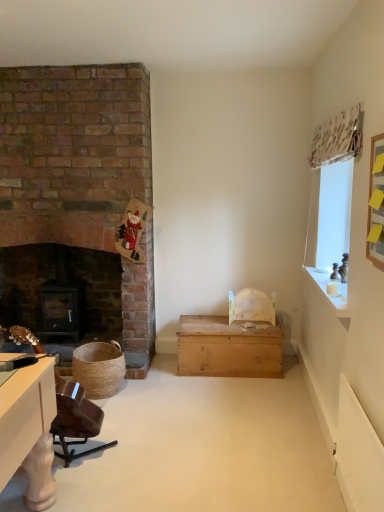
Question: Considering the relative sizes of white wood candle at upper right and wooden chest at center in the image provided, is white wood candle at upper right wider than wooden chest at center?

Choices:
 (A) yes
 (B) no

Answer: (B)

Question: From a real-world perspective, is white wood candle at upper right physically below wooden chest at center?

Choices:
 (A) yes
 (B) no

Answer: (B)

Question: Is white wood candle at upper right aimed at wooden chest at center?

Choices:
 (A) yes
 (B) no

Answer: (B)

Question: Considering the relative sizes of white wood candle at upper right and wooden chest at center in the image provided, is white wood candle at upper right taller than wooden chest at center?

Choices:
 (A) yes
 (B) no

Answer: (B)

Question: Considering the relative positions of white wood candle at upper right and wooden chest at center in the image provided, is white wood candle at upper right to the left of wooden chest at center from the viewer's perspective?

Choices:
 (A) yes
 (B) no

Answer: (B)

Question: From the image's perspective, is white wood candle at upper right beneath wooden chest at center?

Choices:
 (A) no
 (B) yes

Answer: (A)

Question: Is wooden chest at center taller than brown wood swivel chair at lower left?

Choices:
 (A) no
 (B) yes

Answer: (A)

Question: Does wooden chest at center have a larger size compared to brown wood swivel chair at lower left?

Choices:
 (A) yes
 (B) no

Answer: (A)

Question: Could you tell me if wooden chest at center is turned towards brown wood swivel chair at lower left?

Choices:
 (A) yes
 (B) no

Answer: (A)

Question: Is wooden chest at center to the right of brown wood swivel chair at lower left from the viewer's perspective?

Choices:
 (A) yes
 (B) no

Answer: (A)

Question: Can you confirm if wooden chest at center is shorter than brown wood swivel chair at lower left?

Choices:
 (A) no
 (B) yes

Answer: (B)

Question: From the image's perspective, does wooden chest at center appear lower than brown wood swivel chair at lower left?

Choices:
 (A) yes
 (B) no

Answer: (B)

Question: From a real-world perspective, is brown wood swivel chair at lower left located beneath dark wood fireplace at left?

Choices:
 (A) no
 (B) yes

Answer: (B)